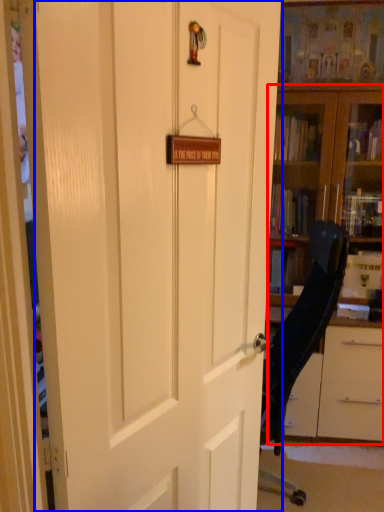
Question: Which point is closer to the camera, bookcase (highlighted by a red box) or door (highlighted by a blue box)?

Choices:
 (A) bookcase
 (B) door

Answer: (B)